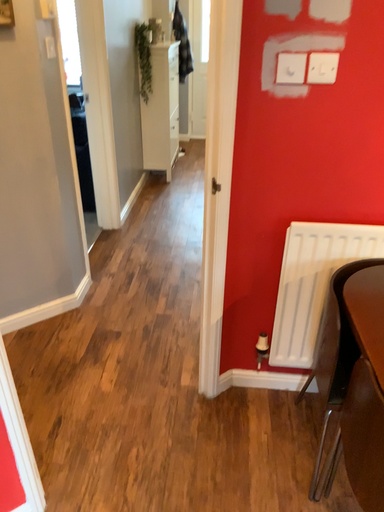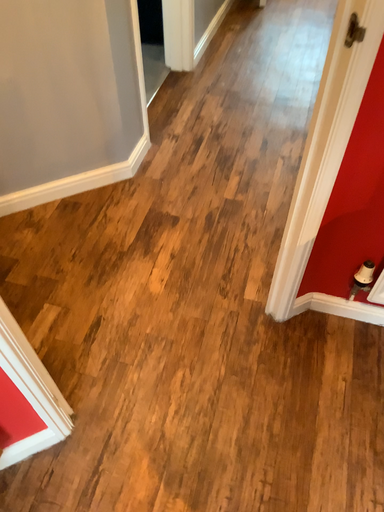
Question: Which way did the camera rotate in the video?

Choices:
 (A) rotated left
 (B) rotated right

Answer: (A)